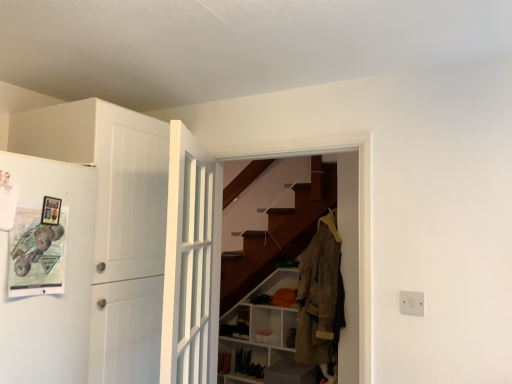
Question: Is white matte cabinet at lower center taller or shorter than tan suede jacket at center?

Choices:
 (A) short
 (B) tall

Answer: (B)

Question: Would you say white matte cabinet at lower center is inside or outside tan suede jacket at center?

Choices:
 (A) inside
 (B) outside

Answer: (B)

Question: Based on their relative distances, which object is farther from the white plastic switch at lower right?

Choices:
 (A) tan suede jacket at center
 (B) white matte door at left, marked as the second door in a right-to-left arrangement
 (C) white matte cabinet at lower center
 (D) white glossy door at center, the 2th door from the left

Answer: (C)

Question: Which is farther from the white glossy door at center, the 2th door from the left?

Choices:
 (A) white matte cabinet at lower center
 (B) tan suede jacket at center
 (C) white matte door at left, which is counted as the 1th door, starting from the left
 (D) white plastic switch at lower right

Answer: (A)